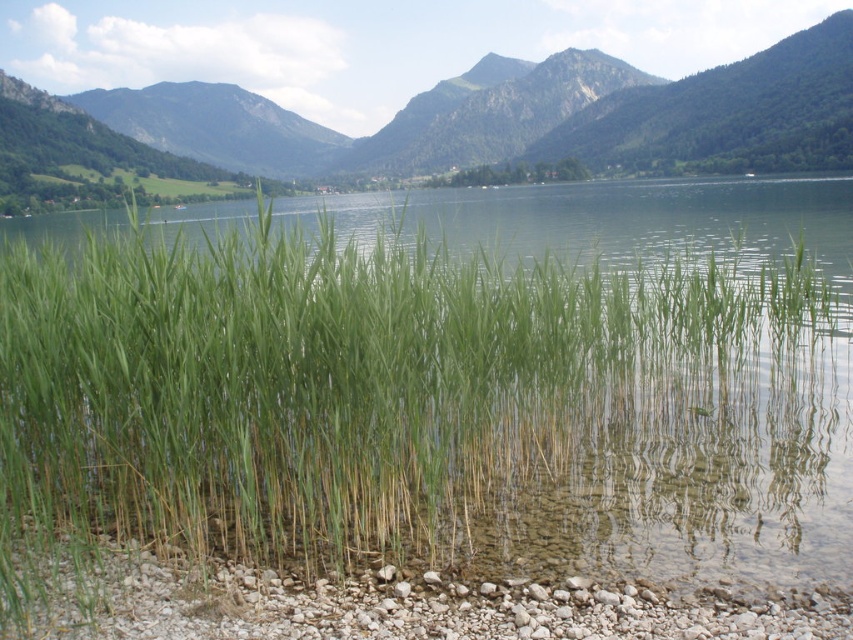
Which is above, green grass at center or green leafy vegetation at center?

Positioned higher is green leafy vegetation at center.

Can you confirm if green grass at center is shorter than green leafy vegetation at center?

Correct, green grass at center is not as tall as green leafy vegetation at center.

Does point (437, 237) come behind point (302, 92)?

No, it is in front of (302, 92).

The image size is (853, 640). I want to click on green grass at center, so click(x=438, y=380).

Does green grass at center appear on the right side of smooth pebbles at lower center?

In fact, green grass at center is to the left of smooth pebbles at lower center.

Who is shorter, green grass at center or smooth pebbles at lower center?

With less height is smooth pebbles at lower center.

Is point (125, 394) closer to camera compared to point (669, 614)?

No, (125, 394) is further to viewer.

Locate an element on the screen. This screenshot has width=853, height=640. green grass at center is located at coordinates (438, 380).

Is green leafy vegetation at center positioned behind smooth pebbles at lower center?

Yes, green leafy vegetation at center is behind smooth pebbles at lower center.

From the picture: Does green leafy vegetation at center appear on the right side of smooth pebbles at lower center?

Incorrect, green leafy vegetation at center is not on the right side of smooth pebbles at lower center.

You are a GUI agent. You are given a task and a screenshot of the screen. Output one action in this format:
    pyautogui.click(x=<x>, y=<y>)
    Task: Click on the green leafy vegetation at center
    The height and width of the screenshot is (640, 853).
    Given the screenshot: What is the action you would take?
    pyautogui.click(x=367, y=42)

Where is `green leafy vegetation at center`? green leafy vegetation at center is located at coordinates (367, 42).